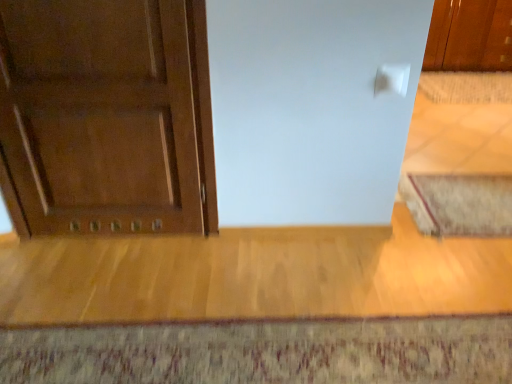
Where is `vacant area on the back side of textured wool doormat at lower center, arranged as the 1th doormat when ordered from the bottom`? vacant area on the back side of textured wool doormat at lower center, arranged as the 1th doormat when ordered from the bottom is located at coordinates (266, 273).